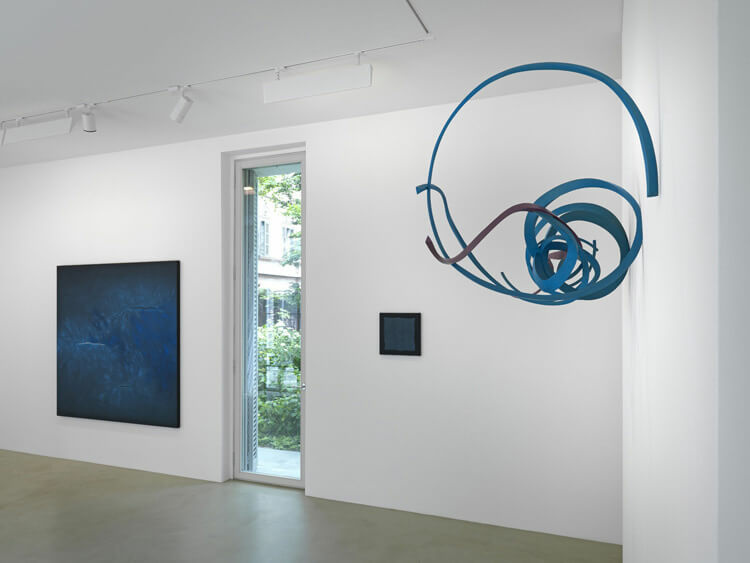
I want to click on ceiling light, so click(x=176, y=108).